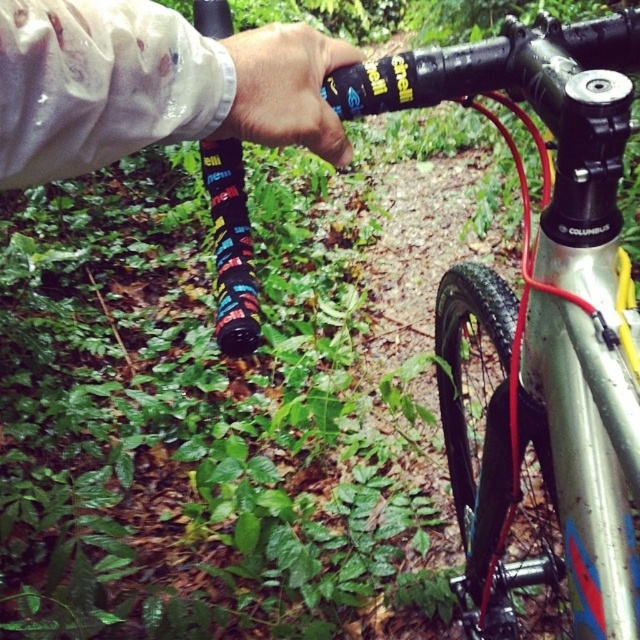
Which is more to the right, silver metallic frame at center or white waterproof glove at upper left?

From the viewer's perspective, silver metallic frame at center appears more on the right side.

Is silver metallic frame at center below white waterproof glove at upper left?

Yes, silver metallic frame at center is below white waterproof glove at upper left.

Where is `silver metallic frame at center`? silver metallic frame at center is located at coordinates (540, 337).

Does white waterproof glove at upper left have a lesser width compared to matte black grip at center?

Incorrect, white waterproof glove at upper left's width is not less than matte black grip at center's.

Is point (273, 68) more distant than point (305, 116)?

No, it is not.

Identify the location of white waterproof glove at upper left. The width and height of the screenshot is (640, 640). (150, 84).

Can you confirm if silver metallic frame at center is positioned to the left of matte black grip at center?

Incorrect, silver metallic frame at center is not on the left side of matte black grip at center.

The width and height of the screenshot is (640, 640). In order to click on silver metallic frame at center in this screenshot , I will do `click(540, 337)`.

Which is in front, point (534, 472) or point (275, 65)?

Point (275, 65)

Where is `silver metallic frame at center`? The width and height of the screenshot is (640, 640). silver metallic frame at center is located at coordinates (540, 337).